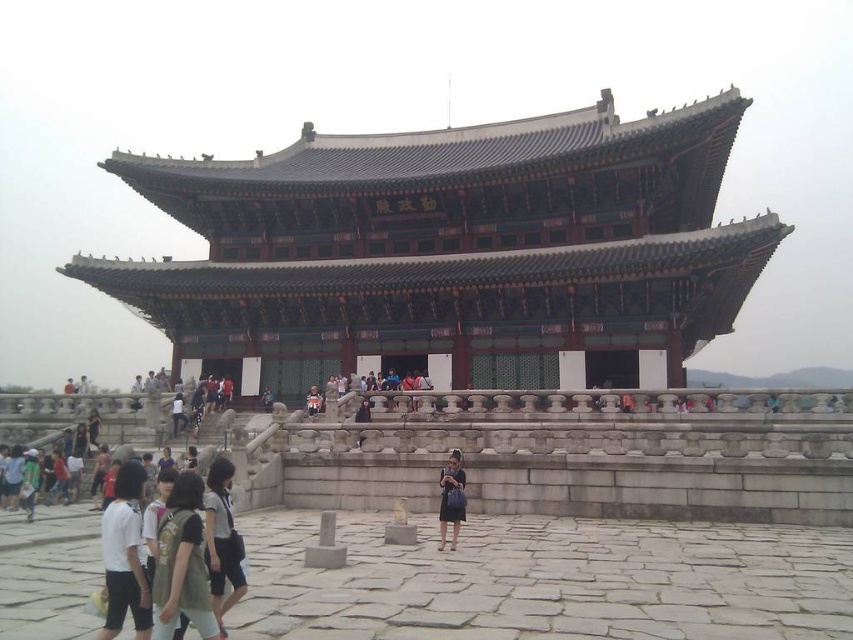
Question: Which of the following is the farthest from the observer?

Choices:
 (A) light brown leather jacket at center
 (B) white cotton shirt at lower left
 (C) polished wood palace at center
 (D) matte black dress at center

Answer: (A)

Question: Is white cotton shirt at lower left further to camera compared to light brown leather jacket at center?

Choices:
 (A) yes
 (B) no

Answer: (B)

Question: Is white cotton shirt at lower left bigger than light brown leather jacket at center?

Choices:
 (A) no
 (B) yes

Answer: (B)

Question: Does polished wood palace at center have a smaller size compared to light brown leather jacket at center?

Choices:
 (A) no
 (B) yes

Answer: (A)

Question: Which point is closer to the camera?

Choices:
 (A) (140, 522)
 (B) (408, 202)

Answer: (A)

Question: Which object is positioned farthest from the polished wood palace at center?

Choices:
 (A) white cotton shirt at lower left
 (B) matte black dress at center

Answer: (A)